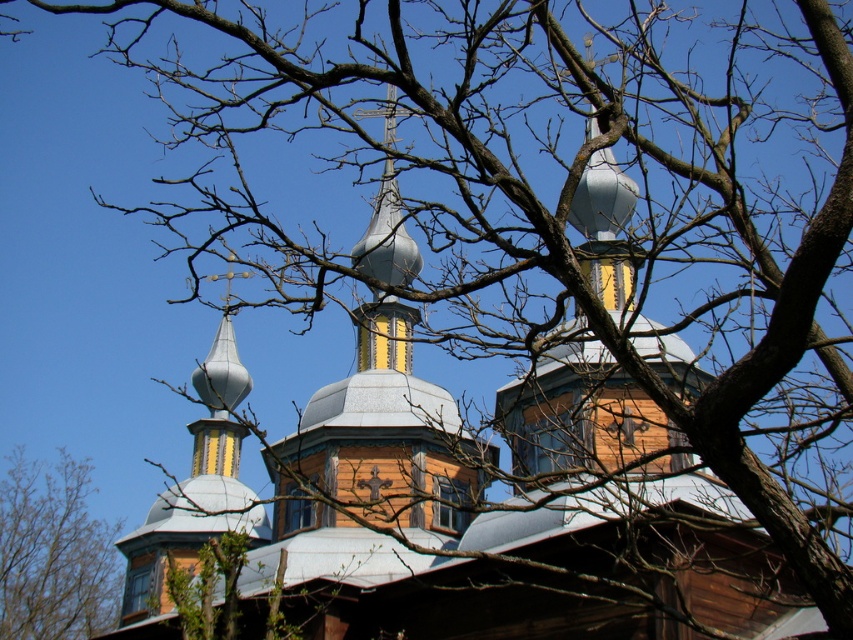
You are standing in front of the traditional wooden church with onion domes. There is a point marked at coordinates [379,442]. What object does this point correspond to?

The point at coordinates [379,442] corresponds to the metallic silver dome at center.

You are standing in front of the church and notice two points marked on the ground. The first point is at coordinates point (288, 456) and the second is at point (67, 636). Which point is closer to you?

Point (288, 456) is in front of point (67, 636), so it is closer to you.

You are standing in front of the church and want to take a photo of the metallic silver dome at center without any obstructions. Are the bare branches at lower left blocking your view of the dome?

The metallic silver dome at center is located above the bare branches at lower left, so the branches are below the dome and would not block your view of the dome.